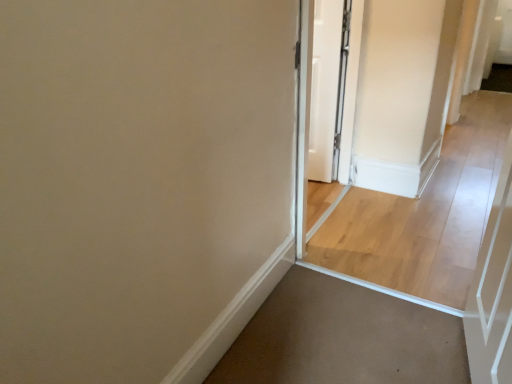
Question: In the image, is white glossy screen door at center positioned in front of or behind light wood floor at center?

Choices:
 (A) behind
 (B) front

Answer: (B)

Question: Is point (348, 142) positioned closer to the camera than point (471, 153)?

Choices:
 (A) farther
 (B) closer

Answer: (B)

Question: Which object is the farthest from the white glossy door at center?

Choices:
 (A) light wood floor at center
 (B) white glossy screen door at center

Answer: (A)

Question: Which is nearer to the white glossy screen door at center?

Choices:
 (A) light wood floor at center
 (B) white glossy door at center

Answer: (B)